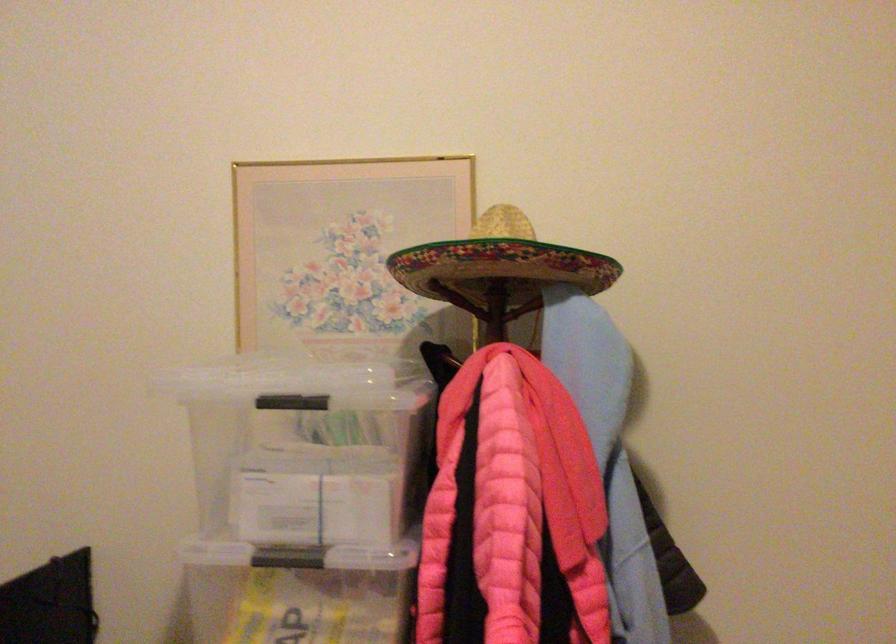
What do you see at coordinates (291, 402) in the screenshot? This screenshot has width=896, height=644. I see `the black bin latch` at bounding box center [291, 402].